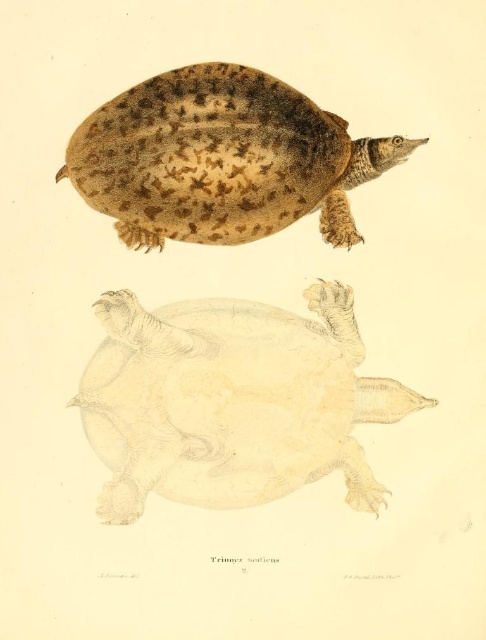
Which of these two, beige textured shell at center or brown textured shell at upper center, stands taller?

Standing taller between the two is beige textured shell at center.

Between beige textured shell at center and brown textured shell at upper center, which one is positioned lower?

beige textured shell at center is below.

Image resolution: width=486 pixels, height=640 pixels. What do you see at coordinates (231, 401) in the screenshot? I see `beige textured shell at center` at bounding box center [231, 401].

Locate an element on the screen. The width and height of the screenshot is (486, 640). beige textured shell at center is located at coordinates (x=231, y=401).